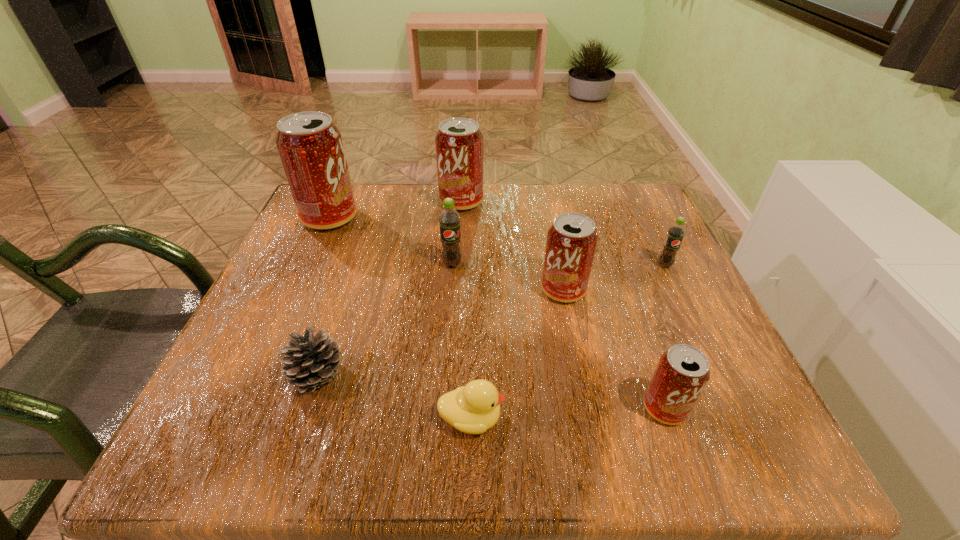
Where is `free point at the left edge`? free point at the left edge is located at coordinates (335, 294).

Where is `vacant space at the right edge of the desktop`? The height and width of the screenshot is (540, 960). vacant space at the right edge of the desktop is located at coordinates (725, 364).

Find the location of `vacant region at the far left corner of the desktop`. vacant region at the far left corner of the desktop is located at coordinates (376, 184).

Locate an element on the screen. The height and width of the screenshot is (540, 960). vacant area at the far right corner is located at coordinates pos(641,203).

This screenshot has width=960, height=540. I want to click on vacant space that's between the third soda can from right to left and the second shortest object, so click(x=441, y=333).

At what (x,y) coordinates should I click in order to perform the action: click on unoccupied position between the pinecone and the rightmost soda can. Please return your answer as a coordinate pair (x, y). The height and width of the screenshot is (540, 960). Looking at the image, I should click on (492, 320).

What are the coordinates of `vacant area between the nearest soda can and the shortest object` in the screenshot? It's located at (568, 413).

Locate an element on the screen. The image size is (960, 540). vacant area between the second soda can from right to left and the left green soda is located at coordinates (559, 336).

You are a GUI agent. You are given a task and a screenshot of the screen. Output one action in this format:
    pyautogui.click(x=<x>, y=<y>)
    Task: Click on the free space between the seventh tallest object and the second red soda can from left to right
    
    Given the screenshot: What is the action you would take?
    tap(390, 288)

The image size is (960, 540). What are the coordinates of `vacant region between the left green soda and the fourth nearest object` in the screenshot? It's located at (508, 277).